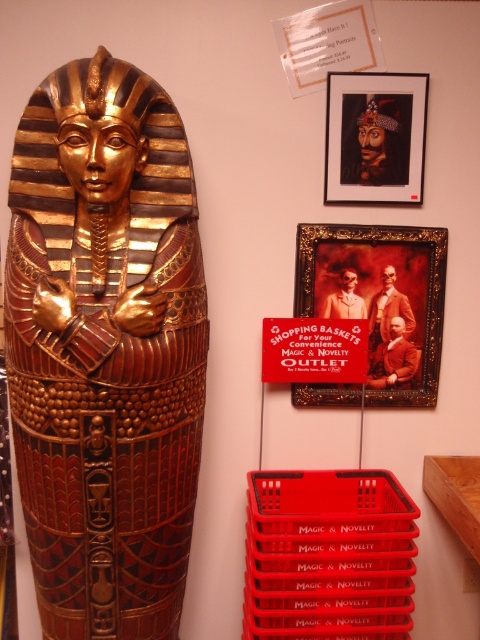
Question: Can you confirm if red plastic crate at lower right is positioned to the left of wooden framed picture at upper center?

Choices:
 (A) no
 (B) yes

Answer: (B)

Question: Which point is farther to the camera?

Choices:
 (A) wooden framed picture at upper center
 (B) matte black portrait at upper center
 (C) gold polished wood sarcophagus at left
 (D) red plastic crate at lower right

Answer: (A)

Question: From the image, what is the correct spatial relationship of red plastic crate at lower right in relation to wooden framed picture at upper center?

Choices:
 (A) right
 (B) left

Answer: (B)

Question: Does red plastic crate at lower right have a smaller size compared to wooden framed picture at upper center?

Choices:
 (A) yes
 (B) no

Answer: (B)

Question: Estimate the real-world distances between objects in this image. Which object is farther from the matte black portrait at upper center?

Choices:
 (A) wooden framed picture at upper center
 (B) gold polished wood sarcophagus at left
 (C) red plastic crate at lower right

Answer: (C)

Question: Among these points, which one is farthest from the camera?

Choices:
 (A) (194, 259)
 (B) (423, 122)

Answer: (B)